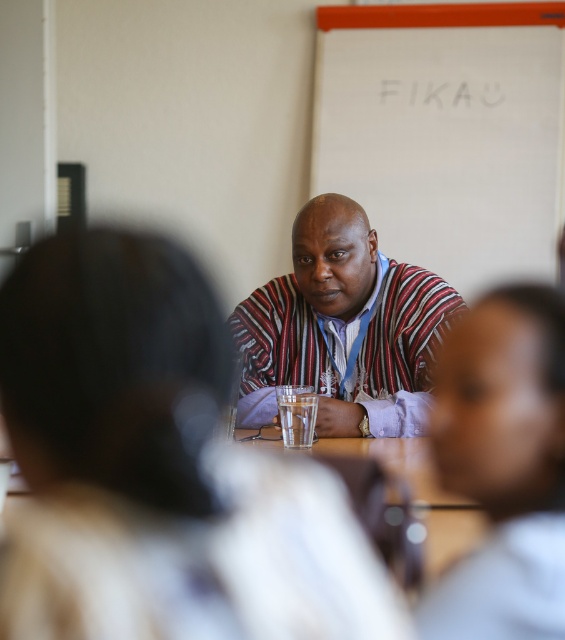
Question: Estimate the real-world distances between objects in this image. Which object is closer to the light gray shirt at center?

Choices:
 (A) whiteboard at upper center
 (B) striped fabric shirt at center

Answer: (B)

Question: From the image, what is the correct spatial relationship of whiteboard at upper center in relation to light gray shirt at center?

Choices:
 (A) above
 (B) below

Answer: (A)

Question: Does whiteboard at upper center have a lesser width compared to light gray shirt at center?

Choices:
 (A) no
 (B) yes

Answer: (A)

Question: Does whiteboard at upper center have a larger size compared to striped fabric shirt at center?

Choices:
 (A) no
 (B) yes

Answer: (B)

Question: Which point is closer to the camera taking this photo?

Choices:
 (A) (241, 301)
 (B) (511, 204)

Answer: (A)

Question: Which object is the farthest from the striped fabric shirt at center?

Choices:
 (A) whiteboard at upper center
 (B) light gray shirt at center

Answer: (A)